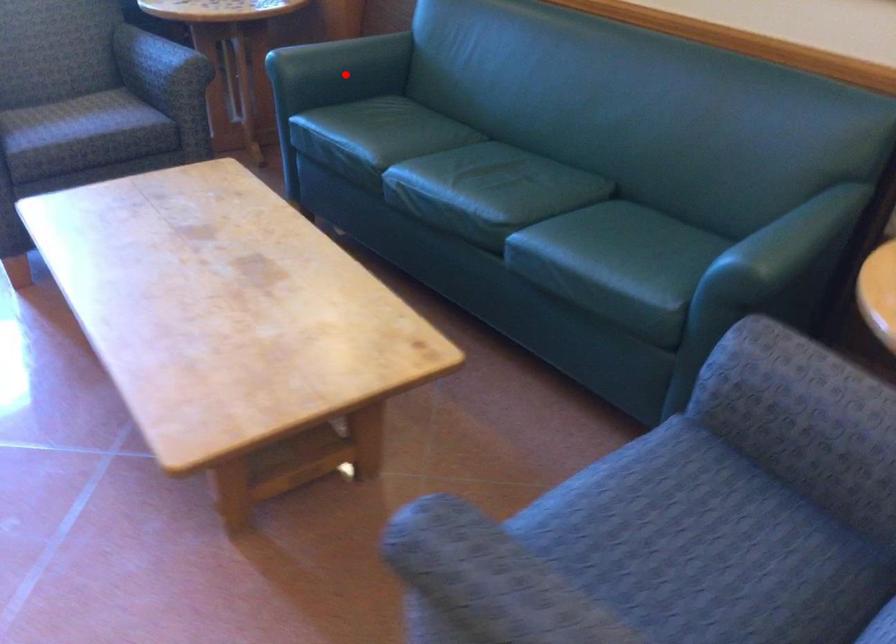
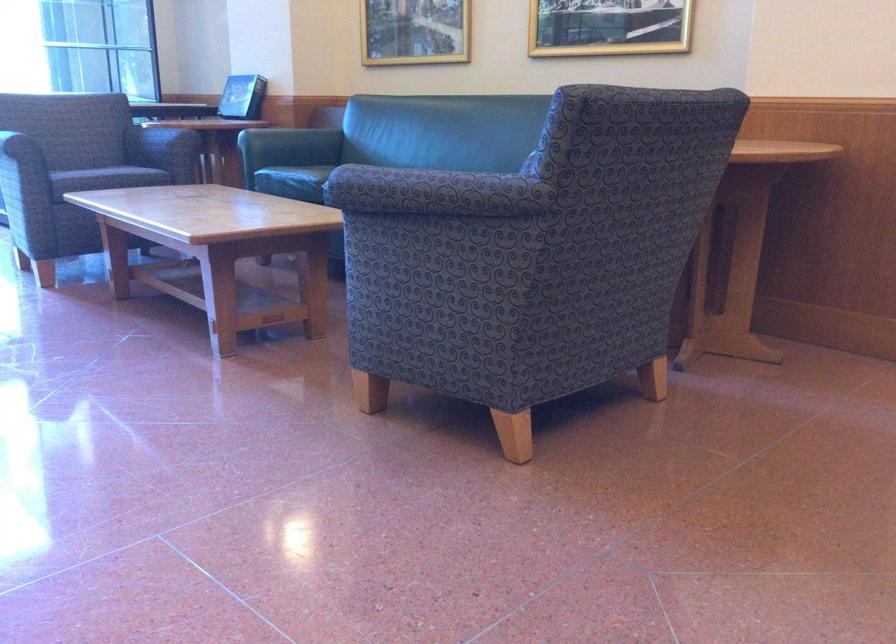
Question: A red point is marked in image1. In image2, is the corresponding 3D point closer to the camera or farther? Reply with the corresponding letter.

Choices:
 (A) The corresponding 3D point is closer.
 (B) The corresponding 3D point is farther.

Answer: (B)